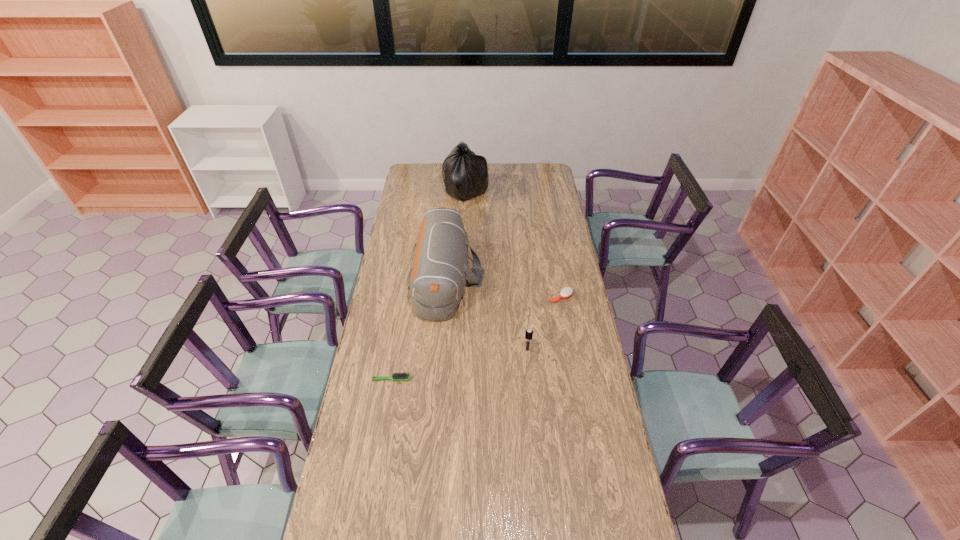
At what (x,y) coordinates should I click in order to perform the action: click on free space located on the right of the duffel bag. Please return your answer as a coordinate pair (x, y). The height and width of the screenshot is (540, 960). Looking at the image, I should click on (568, 278).

This screenshot has width=960, height=540. I want to click on vacant space located 0.240m on the front of the second nearest hairbrush, so click(533, 407).

Identify the location of free space located 0.060m on the back of the rightmost hairbrush. (559, 281).

This screenshot has width=960, height=540. In order to click on vacant space located on the back of the nearest object in this screenshot , I will do `click(400, 327)`.

Where is `object located in the far edge section of the desktop`? The width and height of the screenshot is (960, 540). object located in the far edge section of the desktop is located at coordinates (465, 174).

Identify the location of duffel bag that is at the left edge. (437, 279).

Locate an element on the screen. The image size is (960, 540). hairbrush situated at the left edge is located at coordinates (401, 376).

Where is `object that is positioned at the right edge`? object that is positioned at the right edge is located at coordinates (566, 292).

Identify the location of vacant space at the far edge. This screenshot has height=540, width=960. (437, 167).

Find the location of a particular element. vacant position at the left edge of the desktop is located at coordinates (343, 471).